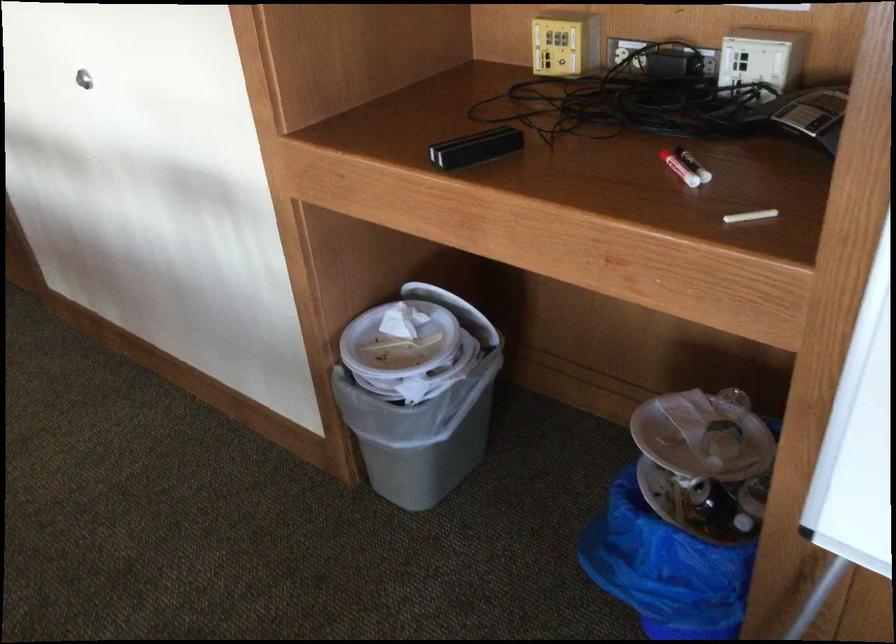
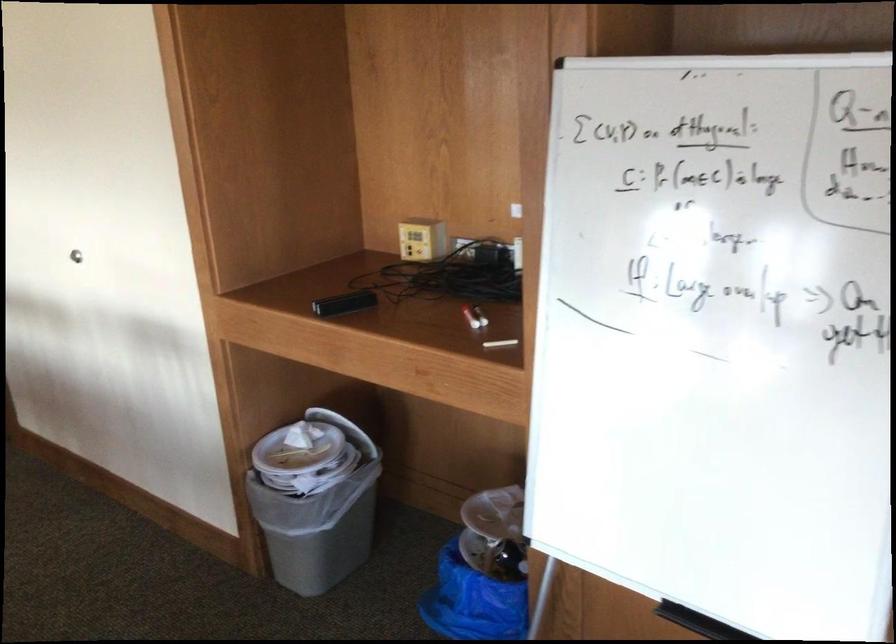
Where in the second image is the point corresponding to (664,552) from the first image?

(472, 601)